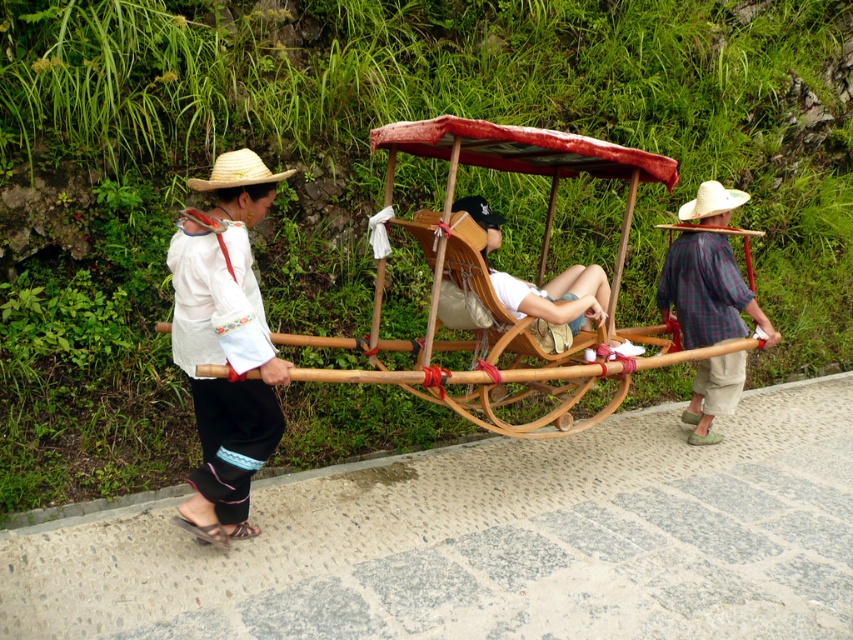
Who is shorter, plaid fabric cart at right or strawtexturehat at left?

strawtexturehat at left is shorter.

Is plaid fabric cart at right below strawtexturehat at left?

Yes, plaid fabric cart at right is below strawtexturehat at left.

Who is more forward, (729,300) or (244,160)?

Point (244,160)

Image resolution: width=853 pixels, height=640 pixels. Identify the location of plaid fabric cart at right. (706, 291).

Can you confirm if white embroidered blouse at left is thinner than white straw hat at center?

Incorrect, white embroidered blouse at left's width is not less than white straw hat at center's.

Is white embroidered blouse at left shorter than white straw hat at center?

No.

Is point (256, 284) farther from viewer compared to point (747, 196)?

That is False.

The image size is (853, 640). In order to click on white embroidered blouse at left in this screenshot , I will do `click(225, 344)`.

Does white embroidered blouse at left have a lesser height compared to plaid fabric cart at right?

In fact, white embroidered blouse at left may be taller than plaid fabric cart at right.

Is white embroidered blouse at left below plaid fabric cart at right?

Yes, white embroidered blouse at left is below plaid fabric cart at right.

Is point (212, 182) farther from camera compared to point (712, 388)?

No, (212, 182) is closer to viewer.

Find the location of a particular element. white embroidered blouse at left is located at coordinates (225, 344).